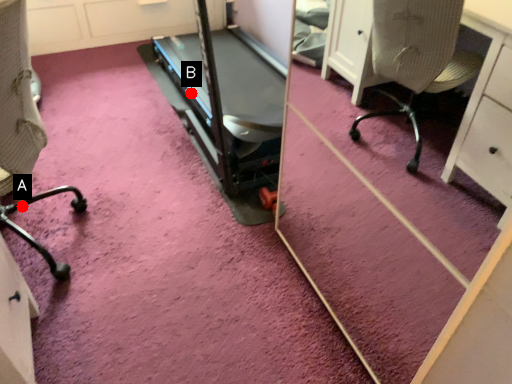
Question: Two points are circled on the image, labeled by A and B beside each circle. Which point is further to the camera?

Choices:
 (A) A is further
 (B) B is further

Answer: (B)